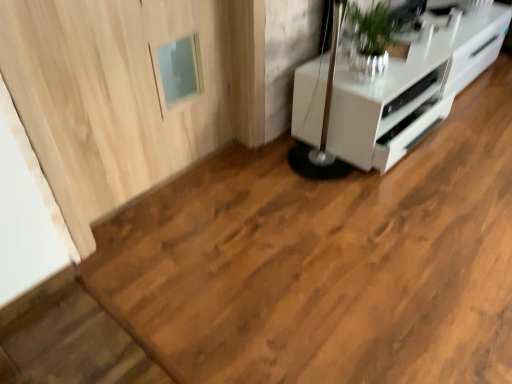
Question: Should I look upward or downward to see light wood door at upper left?

Choices:
 (A) down
 (B) up

Answer: (B)

Question: Does white glossy appliance at upper right have a greater width compared to light wood door at upper left?

Choices:
 (A) yes
 (B) no

Answer: (A)

Question: Are white glossy appliance at upper right and light wood door at upper left located far from each other?

Choices:
 (A) yes
 (B) no

Answer: (B)

Question: Could you tell me if white glossy appliance at upper right is turned towards light wood door at upper left?

Choices:
 (A) yes
 (B) no

Answer: (B)

Question: Is white glossy appliance at upper right taller than light wood door at upper left?

Choices:
 (A) no
 (B) yes

Answer: (A)

Question: From the image's perspective, is white glossy appliance at upper right beneath light wood door at upper left?

Choices:
 (A) yes
 (B) no

Answer: (B)

Question: Is white glossy appliance at upper right not inside light wood door at upper left?

Choices:
 (A) yes
 (B) no

Answer: (A)

Question: Is white glossy cabinet at upper right with white glossy appliance at upper right?

Choices:
 (A) no
 (B) yes

Answer: (A)

Question: From the image's perspective, is white glossy cabinet at upper right on top of white glossy appliance at upper right?

Choices:
 (A) yes
 (B) no

Answer: (A)

Question: Does white glossy cabinet at upper right appear on the right side of white glossy appliance at upper right?

Choices:
 (A) yes
 (B) no

Answer: (A)

Question: Is white glossy cabinet at upper right taller than white glossy appliance at upper right?

Choices:
 (A) no
 (B) yes

Answer: (B)

Question: Are white glossy cabinet at upper right and white glossy appliance at upper right located far from each other?

Choices:
 (A) yes
 (B) no

Answer: (B)

Question: Does white glossy cabinet at upper right come in front of white glossy appliance at upper right?

Choices:
 (A) yes
 (B) no

Answer: (A)

Question: Is white glossy appliance at upper right shorter than white glossy cabinet at upper right?

Choices:
 (A) no
 (B) yes

Answer: (B)